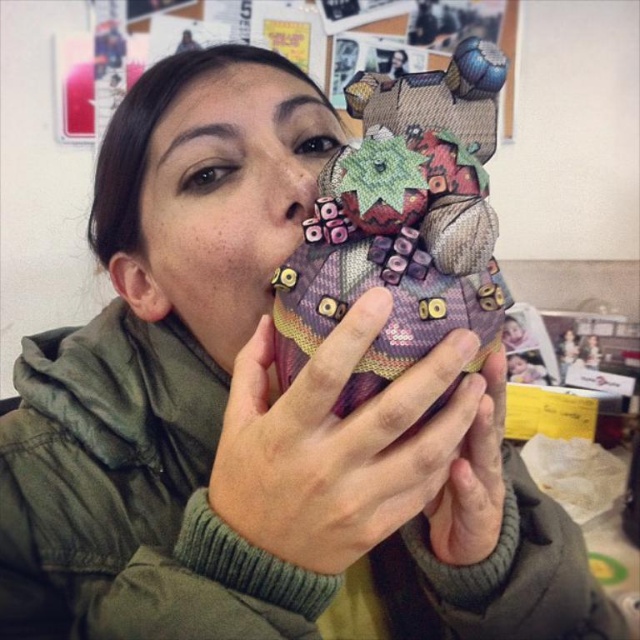
Question: Which is nearer to the matte purple fabric face at center?

Choices:
 (A) purple fabric hand at center
 (B) plaid fabric bear at center

Answer: (B)

Question: Estimate the real-world distances between objects in this image. Which object is closer to the purple fabric hand at center?

Choices:
 (A) matte purple fabric at center
 (B) plaid fabric bear at center
 (C) matte purple fabric face at center

Answer: (A)

Question: Does purple fabric hand at center appear on the right side of matte purple fabric at center?

Choices:
 (A) no
 (B) yes

Answer: (A)

Question: Among these points, which one is farthest from the camera?

Choices:
 (A) (333, 401)
 (B) (256, 120)
 (C) (404, 296)

Answer: (B)

Question: Can you confirm if plaid fabric bear at center is positioned to the left of matte purple fabric face at center?

Choices:
 (A) no
 (B) yes

Answer: (A)

Question: From the image, what is the correct spatial relationship of purple fabric hand at center in relation to matte purple fabric at center?

Choices:
 (A) left
 (B) right

Answer: (A)